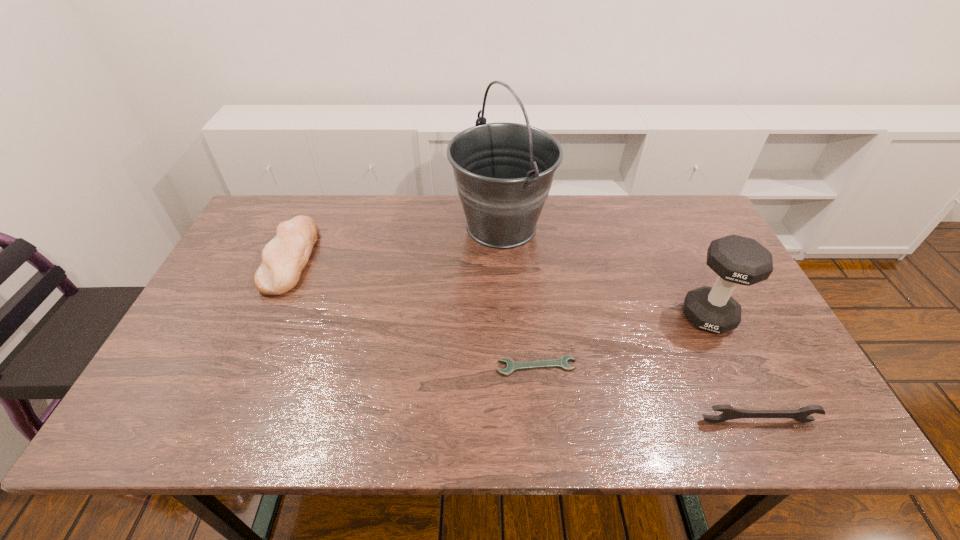
Identify the location of vacant area situated 0.210m on the right of the third shortest object. Image resolution: width=960 pixels, height=540 pixels. (382, 257).

At what (x,y) coordinates should I click in order to perform the action: click on vacant space located on the right of the shorter wrench. Please return your answer as a coordinate pair (x, y). The height and width of the screenshot is (540, 960). Looking at the image, I should click on click(678, 366).

Image resolution: width=960 pixels, height=540 pixels. Identify the location of bucket located at the far edge. (503, 172).

In order to click on bread present at the far edge in this screenshot , I will do `click(283, 258)`.

Find the location of a particular element. This screenshot has height=540, width=960. object located in the near edge section of the desktop is located at coordinates click(801, 415).

Where is `object present at the left edge`? The width and height of the screenshot is (960, 540). object present at the left edge is located at coordinates (283, 258).

Identify the location of dumbbell that is at the right edge. This screenshot has width=960, height=540. (740, 260).

This screenshot has height=540, width=960. I want to click on wrench that is at the right edge, so point(801,415).

Where is `object situated at the far left corner`? The width and height of the screenshot is (960, 540). object situated at the far left corner is located at coordinates (283, 258).

This screenshot has height=540, width=960. What are the coordinates of `object positioned at the near right corner` in the screenshot? It's located at click(x=801, y=415).